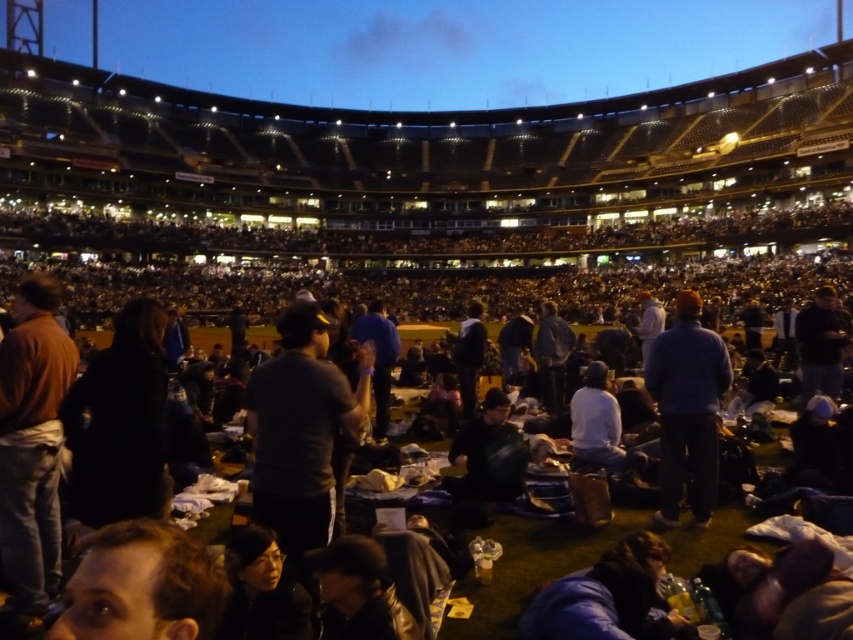
Question: Is blue denim jeans at center bigger than dark gray fabric jacket at center?

Choices:
 (A) no
 (B) yes

Answer: (B)

Question: Among these points, which one is nearest to the camera?

Choices:
 (A) (506, 461)
 (B) (56, 410)

Answer: (B)

Question: Can you confirm if dark gray shirt at center is positioned below brown cotton shirt at left?

Choices:
 (A) no
 (B) yes

Answer: (A)

Question: Which point is closer to the camera taking this photo?

Choices:
 (A) (511, 456)
 (B) (138, 609)
 (C) (33, 397)
 (D) (677, 364)

Answer: (B)

Question: Is brown cotton shirt at left wider than blue denim jeans at center?

Choices:
 (A) yes
 (B) no

Answer: (B)

Question: Which point is closer to the camera?

Choices:
 (A) (672, 456)
 (B) (49, 356)

Answer: (B)